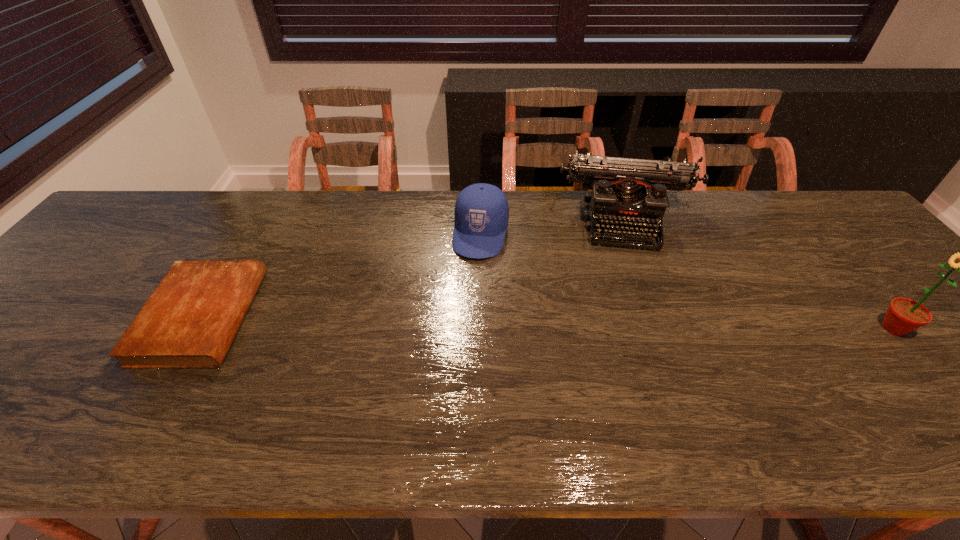
At what (x,y) coordinates should I click in order to perform the action: click on free space on the desktop that is between the Bible and the rightmost object and is positioned on the keyboard of the second object from right to left. Please return your answer as a coordinate pair (x, y). Looking at the image, I should click on (645, 324).

At what (x,y) coordinates should I click in order to perform the action: click on free space on the desktop that is between the Bible and the sunflower and is positioned on the front-facing side of the second shortest object. Please return your answer as a coordinate pair (x, y). Looking at the image, I should click on (460, 321).